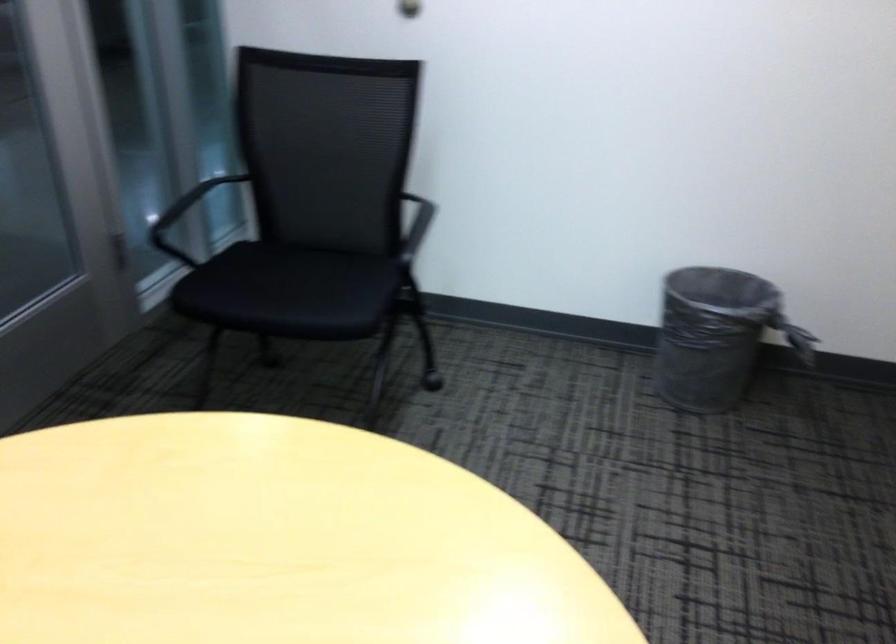
Find where to lift the grey trash can. Please return your answer as a coordinate pair (x, y).

(717, 335)